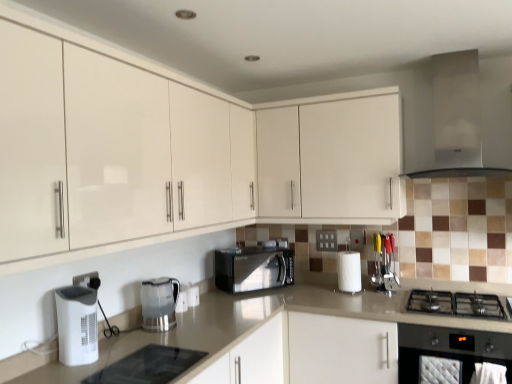
Question: Does white glossy cabinet at upper center, placed as the second cabinetry when sorted from front to back, have a lesser width compared to clear plastic kettle at center, the 2th kitchen appliance when ordered from left to right?

Choices:
 (A) yes
 (B) no

Answer: (B)

Question: Is white glossy cabinet at upper center, placed as the second cabinetry when sorted from front to back, beside clear plastic kettle at center, which is counted as the 2th kitchen appliance, starting from the front?

Choices:
 (A) no
 (B) yes

Answer: (A)

Question: Would you say white glossy cabinet at upper center, the first cabinetry from the back, is a long distance from clear plastic kettle at center, the 2th kitchen appliance when ordered from left to right?

Choices:
 (A) yes
 (B) no

Answer: (A)

Question: Does white glossy cabinet at upper center, the first cabinetry from the back, have a larger size compared to clear plastic kettle at center, the 2th kitchen appliance when ordered from left to right?

Choices:
 (A) yes
 (B) no

Answer: (A)

Question: Is white glossy cabinet at upper center, the first cabinetry from the back, to the left of clear plastic kettle at center, which appears as the 1th kitchen appliance when viewed from the back, from the viewer's perspective?

Choices:
 (A) no
 (B) yes

Answer: (A)

Question: From the image's perspective, relative to white matte paper towel at center, is beige laminate countertop at center above or below?

Choices:
 (A) below
 (B) above

Answer: (A)

Question: Is beige laminate countertop at center taller or shorter than white matte paper towel at center?

Choices:
 (A) tall
 (B) short

Answer: (A)

Question: Do you think beige laminate countertop at center is within white matte paper towel at center, or outside of it?

Choices:
 (A) inside
 (B) outside

Answer: (B)

Question: Is beige laminate countertop at center wider or thinner than white matte paper towel at center?

Choices:
 (A) thin
 (B) wide

Answer: (B)

Question: Would you say beige laminate countertop at center is inside or outside white plastic electric outlet at lower center, which is the 2th electric outlet in back-to-front order?

Choices:
 (A) inside
 (B) outside

Answer: (B)

Question: Considering the positions of beige laminate countertop at center and white plastic electric outlet at lower center, acting as the 1th electric outlet starting from the left, in the image, is beige laminate countertop at center taller or shorter than white plastic electric outlet at lower center, acting as the 1th electric outlet starting from the left,?

Choices:
 (A) tall
 (B) short

Answer: (A)

Question: Is beige laminate countertop at center wider or thinner than white plastic electric outlet at lower center, the 1th electric outlet from the front?

Choices:
 (A) thin
 (B) wide

Answer: (B)

Question: From a real-world perspective, relative to white plastic electric outlet at lower center, acting as the 1th electric outlet starting from the left, is beige laminate countertop at center vertically above or below?

Choices:
 (A) above
 (B) below

Answer: (B)

Question: Is satin silver exhaust hood at upper right taller or shorter than beige laminate countertop at center?

Choices:
 (A) tall
 (B) short

Answer: (B)

Question: Is point (505, 89) positioned closer to the camera than point (373, 294)?

Choices:
 (A) closer
 (B) farther

Answer: (A)